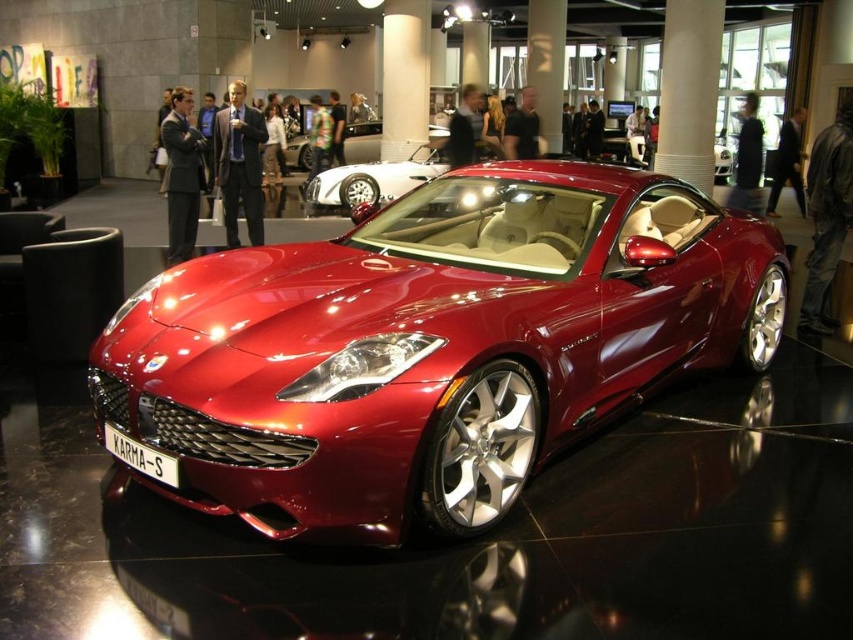
Question: Does shiny red car at center have a smaller size compared to glossy metallic car at center?

Choices:
 (A) no
 (B) yes

Answer: (A)

Question: Which of the following is the farthest from the observer?

Choices:
 (A) shiny red car at center
 (B) shiny metallic sports car at center

Answer: (A)

Question: Can you confirm if shiny metallic sports car at center is positioned above glossy metallic car at center?

Choices:
 (A) yes
 (B) no

Answer: (B)

Question: Which point is closer to the camera?

Choices:
 (A) [305, 339]
 (B) [378, 145]

Answer: (A)

Question: Which object is the closest to the shiny red car at center?

Choices:
 (A) shiny metallic sports car at center
 (B) glossy metallic car at center

Answer: (B)

Question: Observing the image, what is the correct spatial positioning of shiny metallic sports car at center in reference to glossy metallic car at center?

Choices:
 (A) left
 (B) right

Answer: (B)